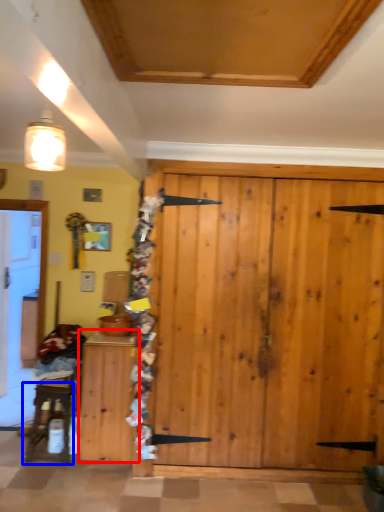
Question: Which object appears farthest to the camera in this image, cabinetry (highlighted by a red box) or furniture (highlighted by a blue box)?

Choices:
 (A) cabinetry
 (B) furniture

Answer: (B)